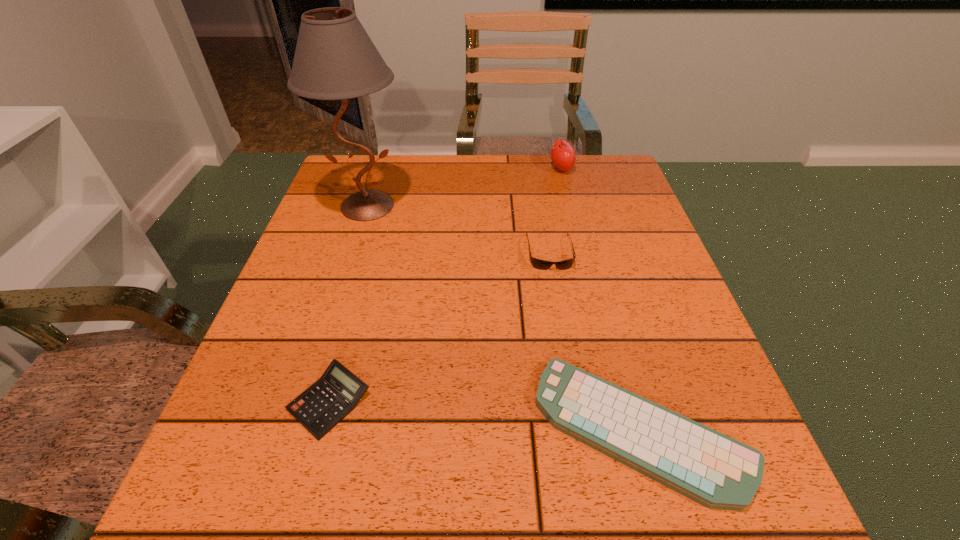
Image resolution: width=960 pixels, height=540 pixels. In order to click on vacant space in between the fourth nearest object and the calculator in this screenshot , I will do click(x=348, y=303).

You are a GUI agent. You are given a task and a screenshot of the screen. Output one action in this format:
    pyautogui.click(x=<x>, y=<y>)
    Task: Click on the vacant area that lies between the computer keyboard and the calculator
    
    Given the screenshot: What is the action you would take?
    pyautogui.click(x=485, y=415)

Where is `vacant area between the calculator and the second farthest object`? This screenshot has height=540, width=960. vacant area between the calculator and the second farthest object is located at coordinates (348, 303).

The width and height of the screenshot is (960, 540). I want to click on free point between the computer keyboard and the calculator, so click(485, 415).

The width and height of the screenshot is (960, 540). Find the location of `vacant region between the computer keyboard and the calculator`. vacant region between the computer keyboard and the calculator is located at coordinates pos(485,415).

At what (x,y) coordinates should I click in order to perform the action: click on vacant space that's between the apple and the sunglasses. Please return your answer as a coordinate pair (x, y). The height and width of the screenshot is (540, 960). Looking at the image, I should click on (556, 210).

Where is `blank region between the third farthest object and the calculator`? blank region between the third farthest object and the calculator is located at coordinates (440, 327).

You are a GUI agent. You are given a task and a screenshot of the screen. Output one action in this format:
    pyautogui.click(x=<x>, y=<y>)
    Task: Click on the object that stands as the fourth closest to the apple
    This screenshot has height=540, width=960.
    Given the screenshot: What is the action you would take?
    pyautogui.click(x=323, y=405)

Locate which object is the fourth closest to the computer keyboard. Please provide its 2D coordinates. Your answer should be formatted as a tuple, i.e. [(x, y)], where the tuple contains the x and y coordinates of a point satisfying the conditions above.

[(563, 156)]

Where is `free point that satisfies the following two spatial constraints: 1. on the front-facing side of the tallest object; 2. on the right side of the calculator`? free point that satisfies the following two spatial constraints: 1. on the front-facing side of the tallest object; 2. on the right side of the calculator is located at coordinates (306, 401).